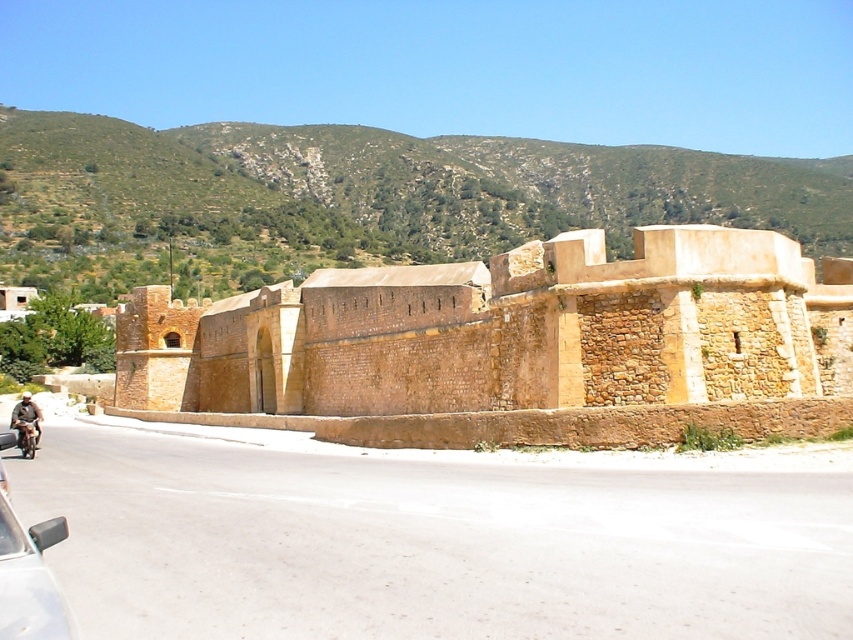
Question: Considering the relative positions of green textured hillside at upper center and shiny chrome motorcycle at lower left in the image provided, where is green textured hillside at upper center located with respect to shiny chrome motorcycle at lower left?

Choices:
 (A) below
 (B) above

Answer: (B)

Question: Based on their relative distances, which object is nearer to the brown leather jacket at lower left?

Choices:
 (A) shiny chrome motorcycle at lower left
 (B) green textured hillside at upper center
 (C) brown stone wall at center

Answer: (A)

Question: Observing the image, what is the correct spatial positioning of brown stone wall at center in reference to shiny chrome motorcycle at lower left?

Choices:
 (A) right
 (B) left

Answer: (A)

Question: Which point is farther from the camera taking this photo?

Choices:
 (A) (35, 420)
 (B) (474, 317)

Answer: (B)

Question: Does silver metallic car at lower left appear under brown leather jacket at lower left?

Choices:
 (A) yes
 (B) no

Answer: (B)

Question: Which object is the farthest from the shiny chrome motorcycle at lower left?

Choices:
 (A) silver metallic car at lower left
 (B) green textured hillside at upper center

Answer: (B)